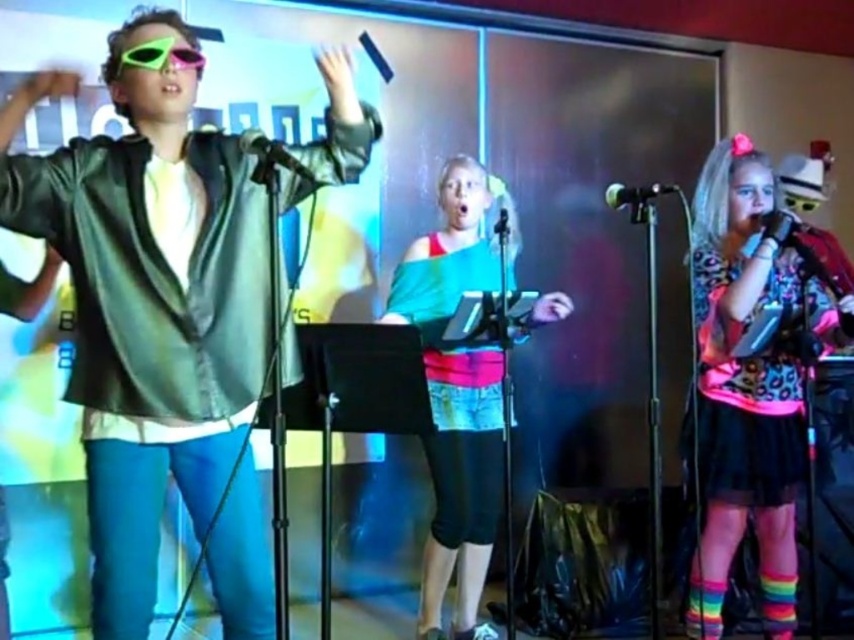
Is point (149, 621) less distant than point (606, 198)?

Yes, point (149, 621) is closer to viewer.

The width and height of the screenshot is (854, 640). I want to click on shiny green jacket at left, so click(156, 332).

Can you confirm if metallic silver microphone at right is positioned above neon plastic sunglasses at upper left?

Incorrect, metallic silver microphone at right is not positioned above neon plastic sunglasses at upper left.

From the picture: Between metallic silver microphone at right and neon plastic sunglasses at upper left, which one appears on the left side from the viewer's perspective?

neon plastic sunglasses at upper left is more to the left.

Is point (808, 259) behind point (192, 52)?

Yes, point (808, 259) is farther from viewer.

Identify the location of metallic silver microphone at right. (811, 250).

Does shiny green jacket at left come in front of metallic silver microphone at right?

Yes, shiny green jacket at left is in front of metallic silver microphone at right.

Is shiny green jacket at left smaller than metallic silver microphone at right?

Actually, shiny green jacket at left might be larger than metallic silver microphone at right.

What do you see at coordinates (156, 332) in the screenshot?
I see `shiny green jacket at left` at bounding box center [156, 332].

This screenshot has width=854, height=640. In order to click on shiny green jacket at left in this screenshot , I will do `click(156, 332)`.